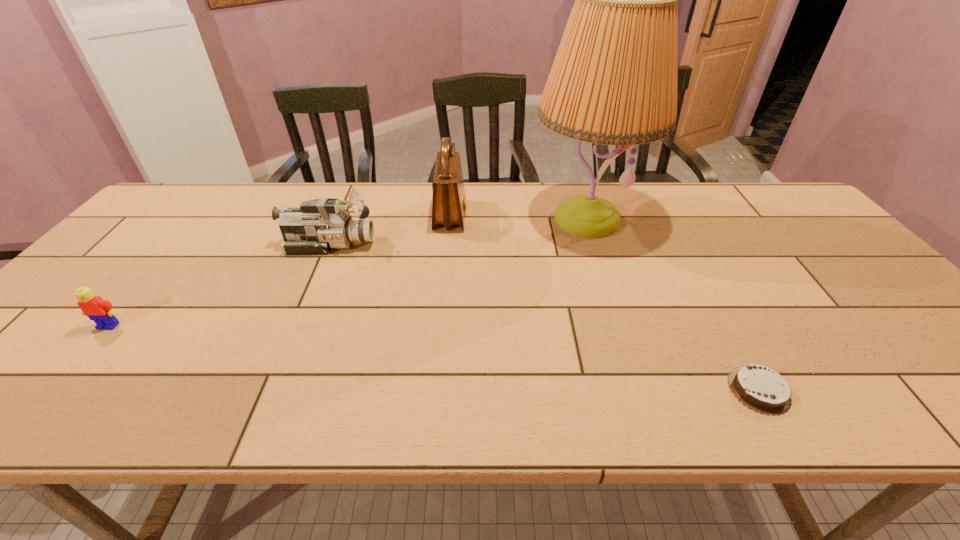
The image size is (960, 540). I want to click on the tallest object, so (614, 79).

In order to click on the second tallest object in this screenshot , I will do `click(448, 205)`.

The height and width of the screenshot is (540, 960). I want to click on the third object from left to right, so click(x=448, y=205).

At what (x,y) coordinates should I click in order to perform the action: click on camcorder. Please return your answer as a coordinate pair (x, y). The height and width of the screenshot is (540, 960). Looking at the image, I should click on (320, 225).

Find the location of a particular element. The width and height of the screenshot is (960, 540). the second object from left to right is located at coordinates (320, 225).

Find the location of a particular element. The image size is (960, 540). the leftmost object is located at coordinates (101, 311).

Find the location of a particular element. the fourth farthest object is located at coordinates coord(101,311).

Find the location of a particular element. the shortest object is located at coordinates (757, 387).

Find the location of `chocolate cake`. chocolate cake is located at coordinates pos(757,387).

Locate an element on the screen. vacant space positioned on the side of the tallest object near the pull switch is located at coordinates (625, 336).